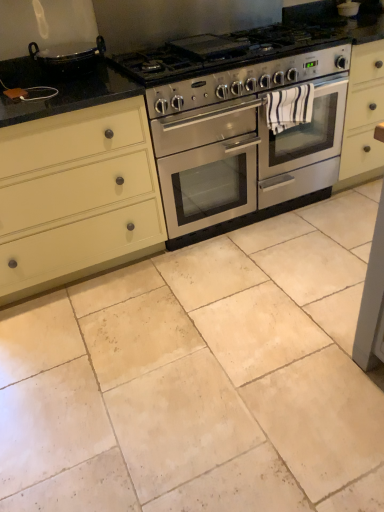
Question: From the image's perspective, is beige stone tile at center above or below black granite countertop at center?

Choices:
 (A) above
 (B) below

Answer: (B)

Question: From their relative heights in the image, would you say beige stone tile at center is taller or shorter than black granite countertop at center?

Choices:
 (A) short
 (B) tall

Answer: (A)

Question: Considering the real-world distances, which object is closest to the beige stone tile at center?

Choices:
 (A) stainless steel oven at center
 (B) matte cream cabinet at left
 (C) black granite countertop at center
 (D) white striped towel at center

Answer: (B)

Question: Which object is the farthest from the matte cream cabinet at left?

Choices:
 (A) beige stone tile at center
 (B) black granite countertop at center
 (C) stainless steel oven at center
 (D) white striped towel at center

Answer: (D)